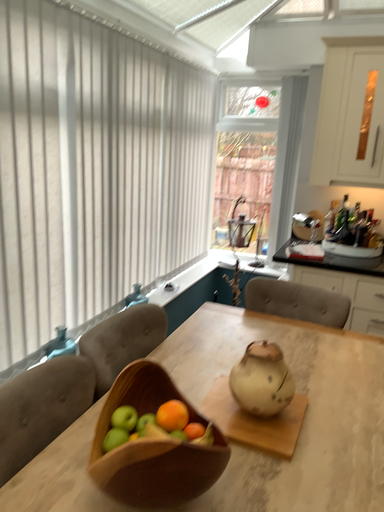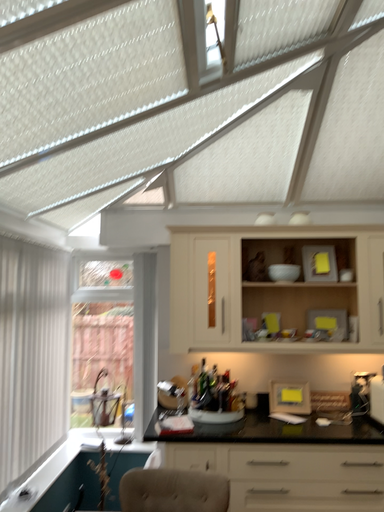
Question: How did the camera likely rotate when shooting the video?

Choices:
 (A) rotated downward
 (B) rotated upward

Answer: (B)